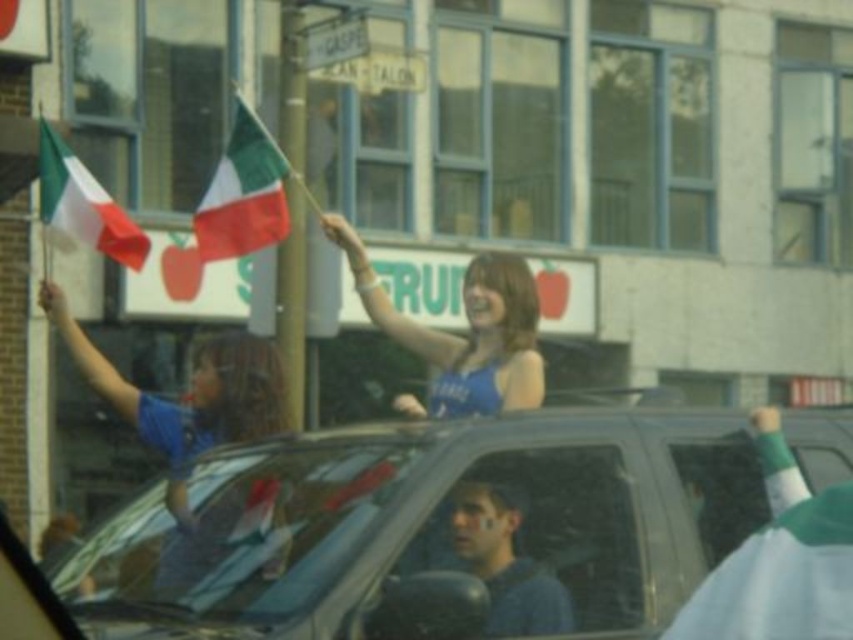
Who is positioned more to the right, transparent plastic window at center or matte fabric flag at upper center?

Positioned to the right is transparent plastic window at center.

Where is `transparent plastic window at center`? This screenshot has height=640, width=853. transparent plastic window at center is located at coordinates (518, 552).

The height and width of the screenshot is (640, 853). What are the coordinates of `transparent plastic window at center` in the screenshot? It's located at (518, 552).

Based on the photo, can you confirm if matte blue shirt at upper left is smaller than matte fabric flag at upper center?

Actually, matte blue shirt at upper left might be larger than matte fabric flag at upper center.

Which is in front, point (190, 456) or point (201, 234)?

Point (190, 456) is in front.

Locate an element on the screen. matte blue shirt at upper left is located at coordinates (186, 396).

Is smooth blue shirt at center taller than matte fabric flag at upper center?

Incorrect, smooth blue shirt at center's height is not larger of matte fabric flag at upper center's.

Is smooth blue shirt at center positioned behind matte fabric flag at upper center?

No.

Where is `smooth blue shirt at center`? smooth blue shirt at center is located at coordinates (502, 561).

This screenshot has height=640, width=853. I want to click on smooth blue shirt at center, so click(502, 561).